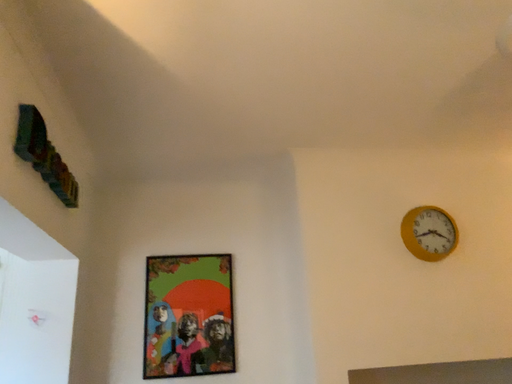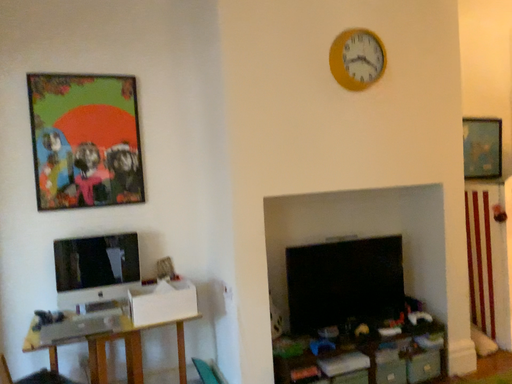
Question: Which way did the camera rotate in the video?

Choices:
 (A) rotated left
 (B) rotated right

Answer: (B)